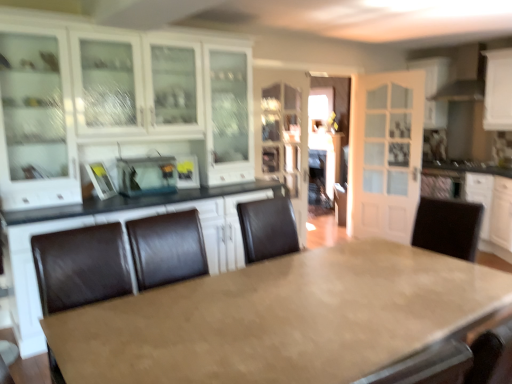
Question: Should I look upward or downward to see matte glass cabinet at center, which appears as the third cabinetry when viewed from the right?

Choices:
 (A) down
 (B) up

Answer: (B)

Question: Does metallic silver toaster at center, the second appliance in the right-to-left sequence, have a smaller size compared to white glossy cabinet at right, the 3th cabinetry in the left-to-right sequence?

Choices:
 (A) yes
 (B) no

Answer: (A)

Question: Is metallic silver toaster at center, which is the 1th appliance from left to right, positioned with its back to white glossy cabinet at right, positioned as the 2th cabinetry in right-to-left order?

Choices:
 (A) no
 (B) yes

Answer: (A)

Question: Is metallic silver toaster at center, the second appliance in the right-to-left sequence, positioned beyond the bounds of white glossy cabinet at right, the 3th cabinetry in the left-to-right sequence?

Choices:
 (A) yes
 (B) no

Answer: (A)

Question: From the image's perspective, would you say metallic silver toaster at center, which is the 1th appliance from left to right, is shown under white glossy cabinet at right, positioned as the 2th cabinetry in right-to-left order?

Choices:
 (A) yes
 (B) no

Answer: (B)

Question: Is metallic silver toaster at center, the second appliance in the right-to-left sequence, positioned behind white glossy cabinet at right, positioned as the 2th cabinetry in right-to-left order?

Choices:
 (A) yes
 (B) no

Answer: (B)

Question: From a real-world perspective, is metallic silver toaster at center, which is the 1th appliance from left to right, located beneath white glossy cabinet at right, positioned as the 2th cabinetry in right-to-left order?

Choices:
 (A) no
 (B) yes

Answer: (A)

Question: Is the depth of white glossy cabinet at upper left, which is the fourth cabinetry from right to left, greater than that of matte glass cabinet at center, acting as the 2th cabinetry starting from the left?

Choices:
 (A) no
 (B) yes

Answer: (A)

Question: Can you confirm if white glossy cabinet at upper left, the 1th cabinetry when ordered from left to right, is thinner than matte glass cabinet at center, which appears as the third cabinetry when viewed from the right?

Choices:
 (A) yes
 (B) no

Answer: (B)

Question: From a real-world perspective, does white glossy cabinet at upper left, which is the fourth cabinetry from right to left, stand above matte glass cabinet at center, which appears as the third cabinetry when viewed from the right?

Choices:
 (A) yes
 (B) no

Answer: (A)

Question: Does white glossy cabinet at upper left, the 1th cabinetry when ordered from left to right, have a smaller size compared to matte glass cabinet at center, which appears as the third cabinetry when viewed from the right?

Choices:
 (A) yes
 (B) no

Answer: (B)

Question: Is white glossy cabinet at upper left, the 1th cabinetry when ordered from left to right, bigger than matte glass cabinet at center, which appears as the third cabinetry when viewed from the right?

Choices:
 (A) no
 (B) yes

Answer: (B)

Question: Is white glossy cabinet at upper left, the 1th cabinetry when ordered from left to right, shorter than matte glass cabinet at center, acting as the 2th cabinetry starting from the left?

Choices:
 (A) no
 (B) yes

Answer: (A)

Question: Is white glossy exhaust hood at upper right not close to matte brown table at center?

Choices:
 (A) yes
 (B) no

Answer: (A)